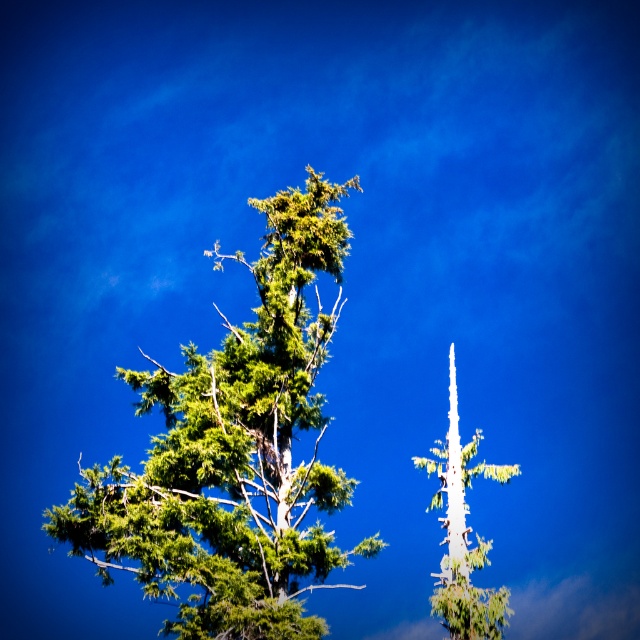
Question: Can you confirm if green textured tree at center is wider than green matte tree at center?

Choices:
 (A) yes
 (B) no

Answer: (A)

Question: Which object appears farthest from the camera in this image?

Choices:
 (A) green matte tree at center
 (B) green textured tree at center

Answer: (B)

Question: Which point is closer to the camera?

Choices:
 (A) (152, 488)
 (B) (454, 625)

Answer: (B)

Question: Is green textured tree at center bigger than green matte tree at center?

Choices:
 (A) yes
 (B) no

Answer: (A)

Question: Can you confirm if green textured tree at center is bigger than green matte tree at center?

Choices:
 (A) no
 (B) yes

Answer: (B)